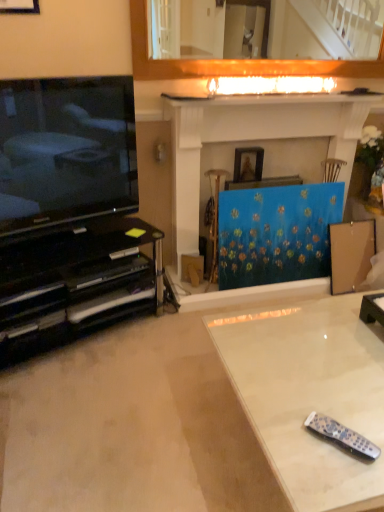
What are the coordinates of `unoccupied area in front of black glass tv stand at lower left` in the screenshot? It's located at (86, 410).